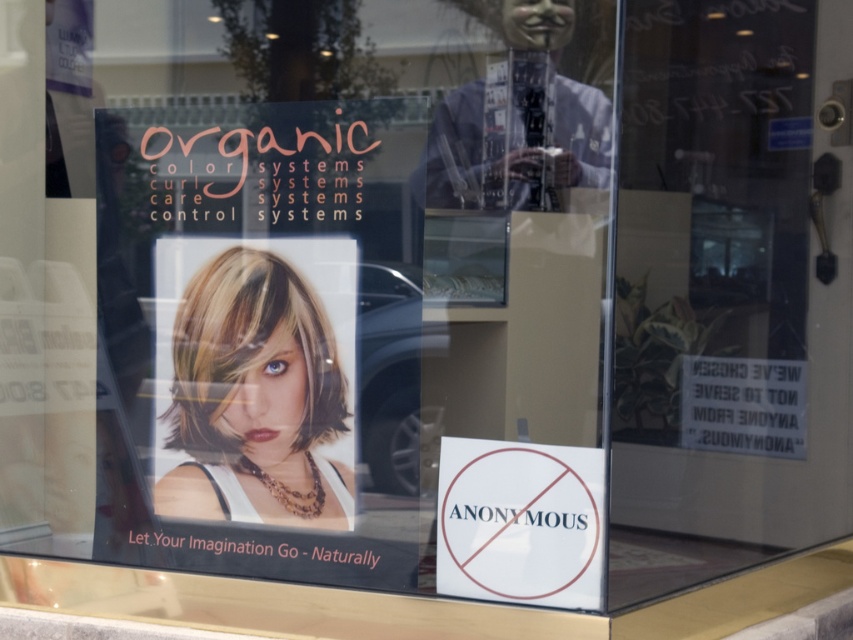
Question: Does blonde hair at center have a greater width compared to white paper sign at lower center?

Choices:
 (A) no
 (B) yes

Answer: (B)

Question: In this image, where is blonde hair at center located relative to white paper sign at lower center?

Choices:
 (A) below
 (B) above

Answer: (B)

Question: Does blonde hair at center appear on the right side of white paper sign at lower center?

Choices:
 (A) yes
 (B) no

Answer: (B)